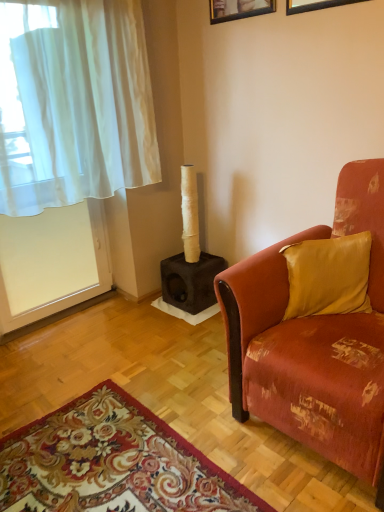
Question: Which direction should I rotate to face wooden picture frame at upper center, the second picture frame when ordered from right to left, — up or down?

Choices:
 (A) down
 (B) up

Answer: (B)

Question: Considering the relative sizes of wooden picture frame at upper center, the second picture frame when ordered from right to left, and white sheer curtain at left in the image provided, is wooden picture frame at upper center, the second picture frame when ordered from right to left, smaller than white sheer curtain at left?

Choices:
 (A) no
 (B) yes

Answer: (B)

Question: From a real-world perspective, is wooden picture frame at upper center, which appears as the 1th picture frame when viewed from the left, positioned over white sheer curtain at left based on gravity?

Choices:
 (A) yes
 (B) no

Answer: (A)

Question: Is wooden picture frame at upper center, the second picture frame when ordered from right to left, not within white sheer curtain at left?

Choices:
 (A) yes
 (B) no

Answer: (A)

Question: Is there a large distance between wooden picture frame at upper center, which is the 1th picture frame from back to front, and white sheer curtain at left?

Choices:
 (A) no
 (B) yes

Answer: (A)

Question: Does wooden picture frame at upper center, placed as the second picture frame when sorted from front to back, appear on the right side of white sheer curtain at left?

Choices:
 (A) no
 (B) yes

Answer: (B)

Question: From a real-world perspective, is wooden picture frame at upper center, which appears as the 1th picture frame when viewed from the left, positioned under white sheer curtain at left based on gravity?

Choices:
 (A) no
 (B) yes

Answer: (A)

Question: Is velvet orange couch at right taller than white sheer curtain at left?

Choices:
 (A) no
 (B) yes

Answer: (B)

Question: From a real-world perspective, is velvet orange couch at right on white sheer curtain at left?

Choices:
 (A) no
 (B) yes

Answer: (A)

Question: Is velvet orange couch at right behind white sheer curtain at left?

Choices:
 (A) no
 (B) yes

Answer: (A)

Question: From the image's perspective, would you say velvet orange couch at right is shown under white sheer curtain at left?

Choices:
 (A) no
 (B) yes

Answer: (B)

Question: Can you confirm if velvet orange couch at right is thinner than white sheer curtain at left?

Choices:
 (A) yes
 (B) no

Answer: (B)

Question: Is velvet orange couch at right at the left side of white sheer curtain at left?

Choices:
 (A) no
 (B) yes

Answer: (A)

Question: Is floral carpet at lower left with silky gold pillow at right?

Choices:
 (A) yes
 (B) no

Answer: (B)